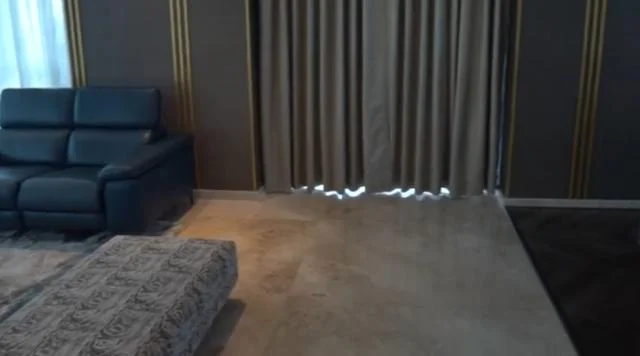
Where is `light under curtains`? The image size is (640, 356). light under curtains is located at coordinates (354, 194).